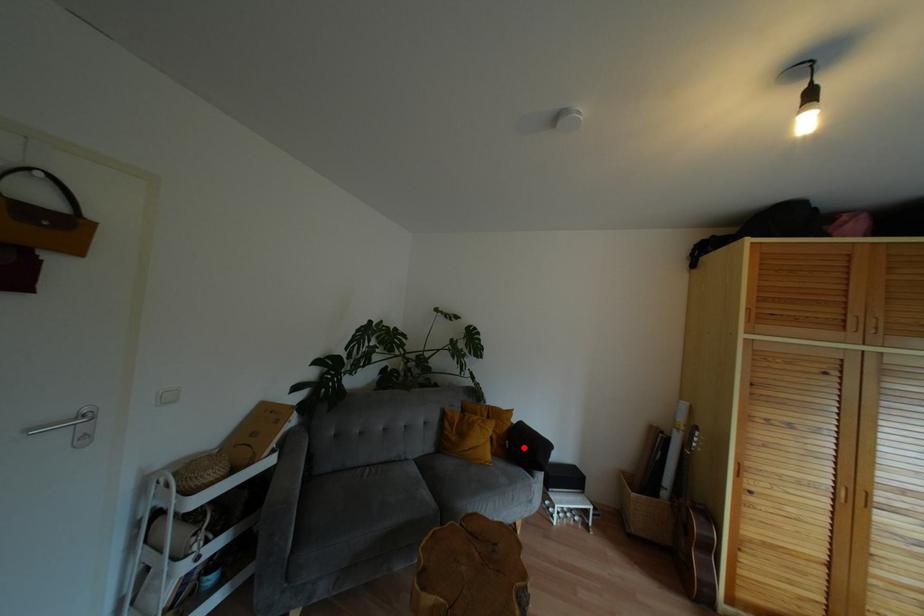
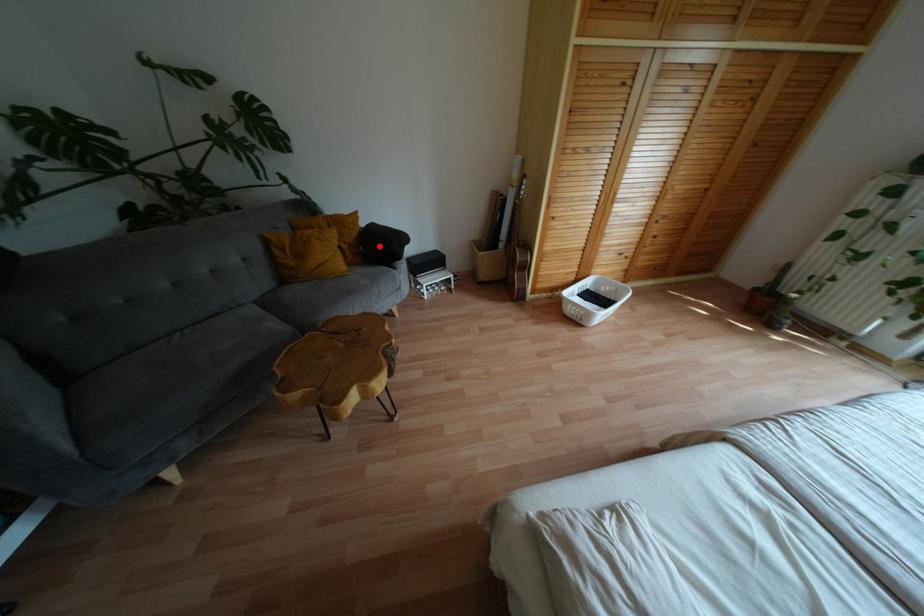
I am providing you with two images of the same scene from different viewpoints. A red point is marked on the first image and another point is marked on the second image. Does the point marked in image1 correspond to the same location as the one in image2?

Yes